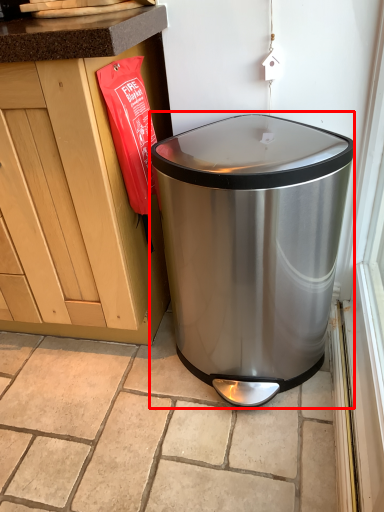
Question: From the image's perspective, where is waste container (annotated by the red box) located in relation to tile in the image?

Choices:
 (A) above
 (B) below

Answer: (A)